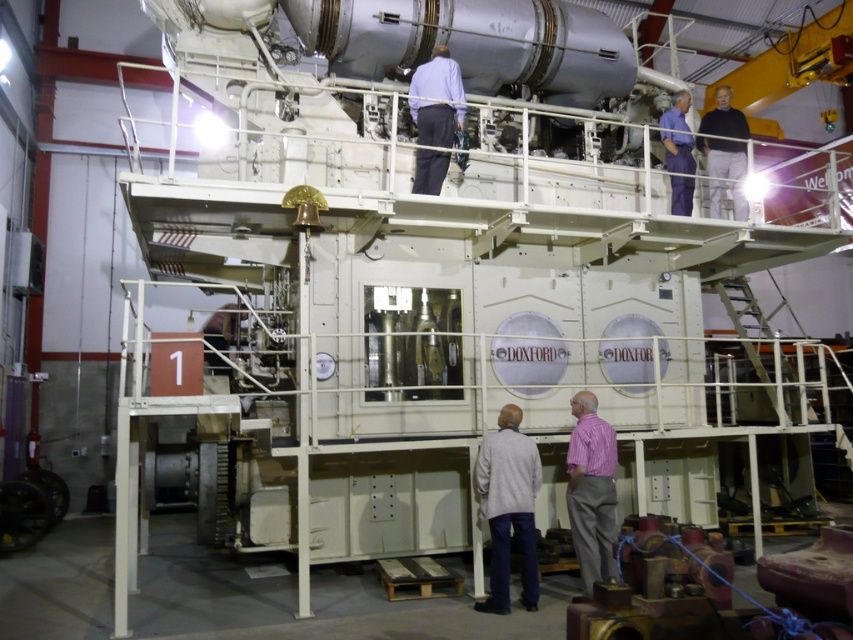
Question: Which point is farther from the camera taking this photo?

Choices:
 (A) pos(613,436)
 (B) pos(721,102)
 (C) pos(532,451)

Answer: (B)

Question: Among these points, which one is farthest from the camera?

Choices:
 (A) (421, 170)
 (B) (671, 161)
 (C) (480, 456)
 (D) (595, 524)

Answer: (B)

Question: Does light gray fabric shirt at lower center appear under gray cotton shirt at lower center?

Choices:
 (A) yes
 (B) no

Answer: (B)

Question: Does light gray fabric shirt at lower center have a smaller size compared to pink cotton shirt at lower center?

Choices:
 (A) no
 (B) yes

Answer: (B)

Question: Which of the following is the farthest from the observer?

Choices:
 (A) (517, 468)
 (B) (438, 52)
 (C) (583, 401)
 (D) (683, 120)

Answer: (D)

Question: Is light gray fabric shirt at lower center further to the viewer compared to pink cotton shirt at lower center?

Choices:
 (A) yes
 (B) no

Answer: (A)